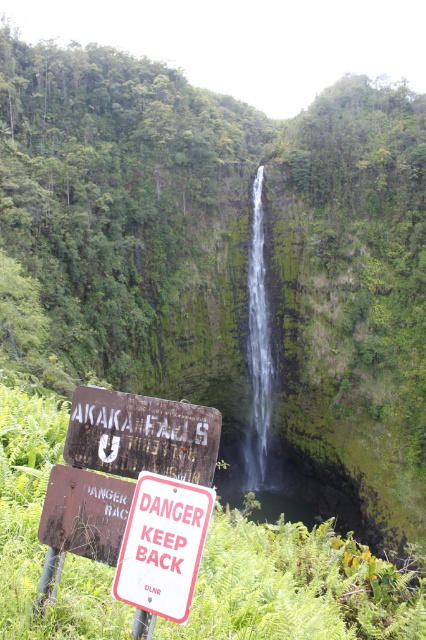
Question: Among these points, which one is nearest to the camera?

Choices:
 (A) (152, 500)
 (B) (267, 392)
 (C) (83, 465)

Answer: (A)

Question: Is rusty wood sign at lower center bigger than clear glass waterfall at center?

Choices:
 (A) yes
 (B) no

Answer: (B)

Question: Which object is positioned closest to the rusty wood sign at lower center?

Choices:
 (A) red plastic sign at lower center
 (B) clear glass waterfall at center

Answer: (A)

Question: Does rusty wood sign at lower center have a greater width compared to clear glass waterfall at center?

Choices:
 (A) yes
 (B) no

Answer: (B)

Question: Is rusty wood sign at lower center closer to the viewer compared to clear glass waterfall at center?

Choices:
 (A) yes
 (B) no

Answer: (A)

Question: Which point is farther from the camera taking this photo?

Choices:
 (A) tap(137, 500)
 (B) tap(262, 284)
 (C) tap(193, 465)

Answer: (B)